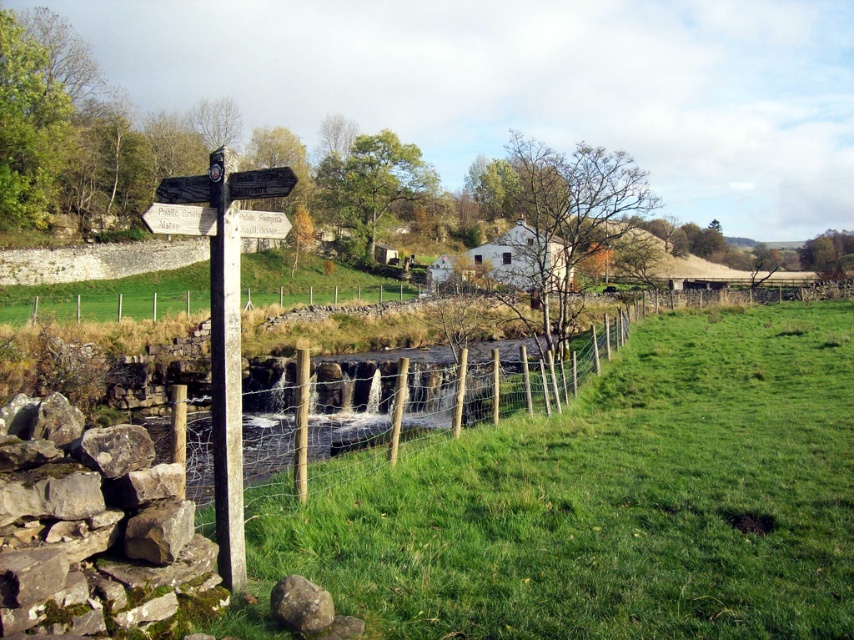
Which is in front, point (771, 404) or point (264, 419)?

Point (771, 404) is more forward.

Can you confirm if green grassy at center is smaller than wire mesh fence at center?

Yes, green grassy at center is smaller than wire mesh fence at center.

Is point (629, 340) positioned behind point (405, 420)?

Yes, it is behind point (405, 420).

At what (x,y) coordinates should I click in order to perform the action: click on green grassy at center. Please return your answer as a coordinate pair (x, y). The height and width of the screenshot is (640, 854). Looking at the image, I should click on (605, 500).

Which is behind, point (220, 474) or point (326, 620)?

The point (220, 474) is behind.

Does point (234, 458) lie in front of point (301, 628)?

No, (234, 458) is further to viewer.

You are a GUI agent. You are given a task and a screenshot of the screen. Output one action in this format:
    pyautogui.click(x=<x>, y=<y>)
    Task: Click on the white wooden signpost at left
    This screenshot has width=854, height=640.
    Given the screenshot: What is the action you would take?
    pyautogui.click(x=225, y=330)

Is the position of green grassy at center more distant than that of mossy stone wall at lower left?

Yes.

Which is above, green grassy at center or mossy stone wall at lower left?

Positioned higher is mossy stone wall at lower left.

This screenshot has width=854, height=640. What do you see at coordinates (605, 500) in the screenshot? I see `green grassy at center` at bounding box center [605, 500].

This screenshot has width=854, height=640. What are the coordinates of `green grassy at center` in the screenshot? It's located at (605, 500).